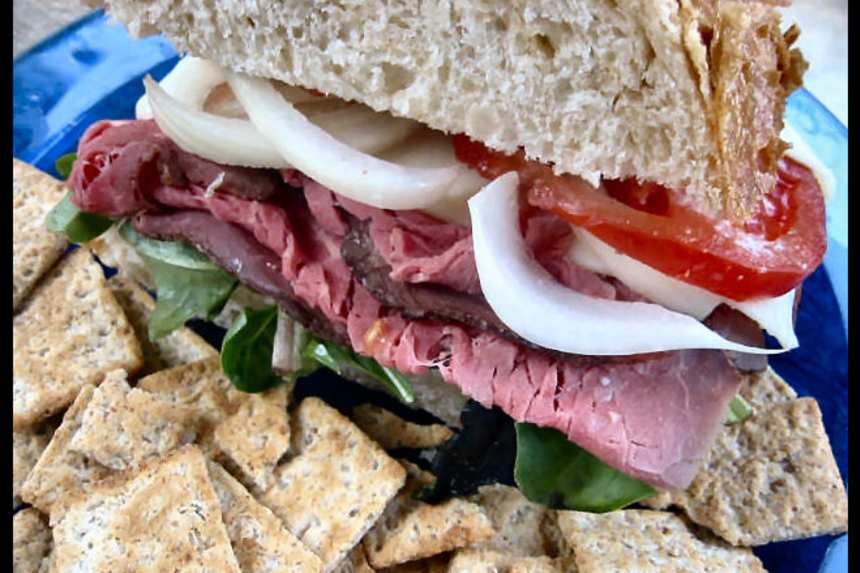
I want to click on plate, so click(89, 68), click(825, 560), click(845, 429).